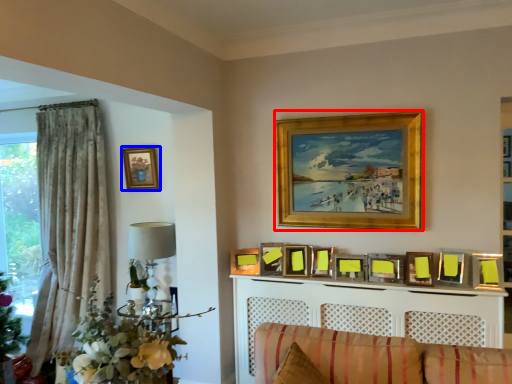
Question: Which object is further to the camera taking this photo, picture frame (highlighted by a red box) or picture frame (highlighted by a blue box)?

Choices:
 (A) picture frame
 (B) picture frame

Answer: (B)